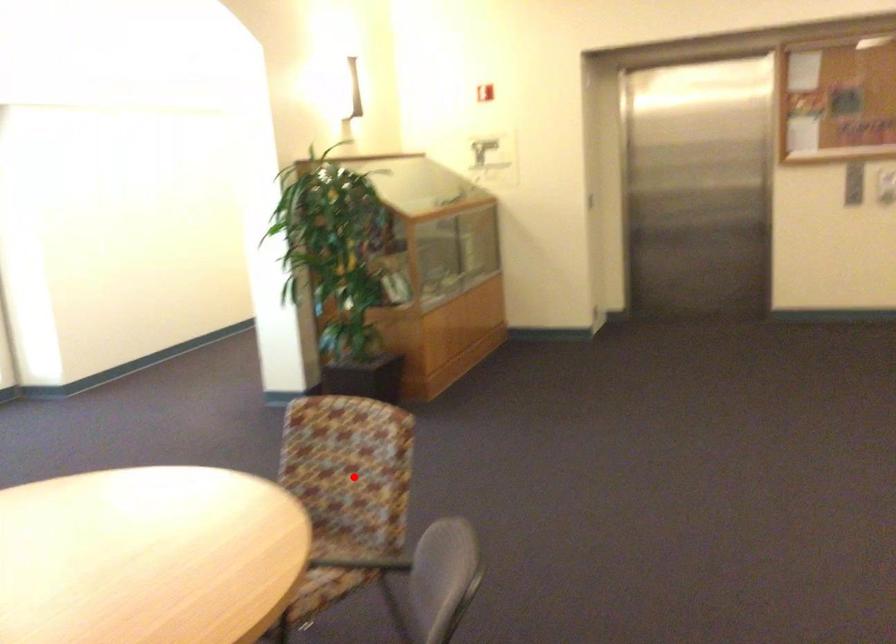
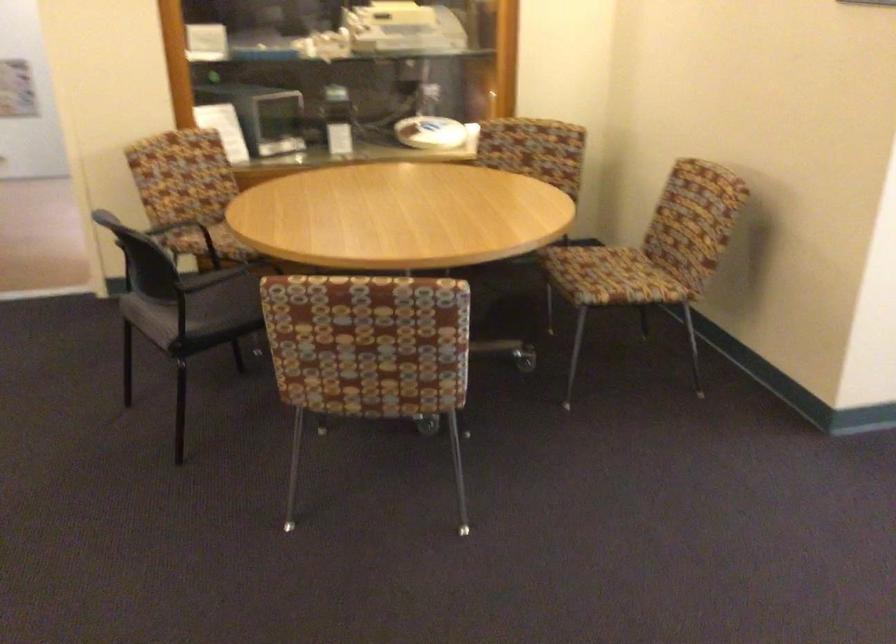
Question: I am providing you with two images of the same scene from different viewpoints. Image1 has a red point marked. In image2, the corresponding 3D location appears at what relative position? Reply with the corresponding letter.

Choices:
 (A) Closer
 (B) Farther

Answer: (A)